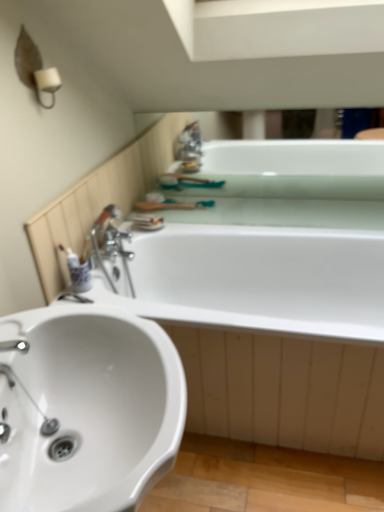
Question: Is white glossy bathtub at upper center, the second bath from the bottom, inside the boundaries of white glossy toothbrush at left, or outside?

Choices:
 (A) outside
 (B) inside

Answer: (A)

Question: Relative to white glossy toothbrush at left, is white glossy bathtub at upper center, the second bath from the bottom, in front or behind?

Choices:
 (A) front
 (B) behind

Answer: (B)

Question: Which object is the closest to the white glossy bathtub at center, which is the 1th bath from bottom to top?

Choices:
 (A) white glossy bathtub at upper center, the first bath when ordered from top to bottom
 (B) white glossy toothbrush at left
 (C) white glossy sink at lower left

Answer: (A)

Question: Which object is positioned closest to the white glossy bathtub at center, which is the 1th bath from bottom to top?

Choices:
 (A) white glossy toothbrush at left
 (B) white glossy sink at lower left
 (C) white glossy bathtub at upper center, the first bath when ordered from top to bottom

Answer: (C)